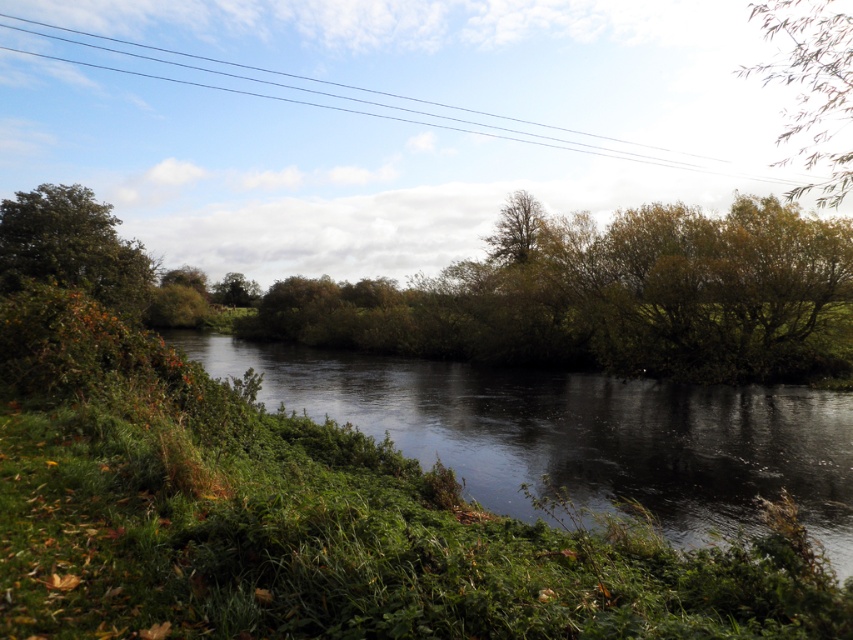
Question: Which of the following is the closest to the observer?

Choices:
 (A) (782, 394)
 (B) (20, 198)
 (C) (839, 52)

Answer: (C)

Question: Is green leafy tree at left smaller than green leafy tree at upper right?

Choices:
 (A) yes
 (B) no

Answer: (A)

Question: Which of these objects is positioned closest to the green leafy tree at upper center?

Choices:
 (A) green leafy tree at center
 (B) green grassy river at center

Answer: (B)

Question: Can you confirm if green grassy river at center is thinner than green leafy tree at upper center?

Choices:
 (A) yes
 (B) no

Answer: (B)

Question: Which object is farther from the camera taking this photo?

Choices:
 (A) green leafy tree at upper center
 (B) green grassy river at center

Answer: (A)

Question: Is black wire at upper center to the left of green grassy river at center from the viewer's perspective?

Choices:
 (A) no
 (B) yes

Answer: (B)